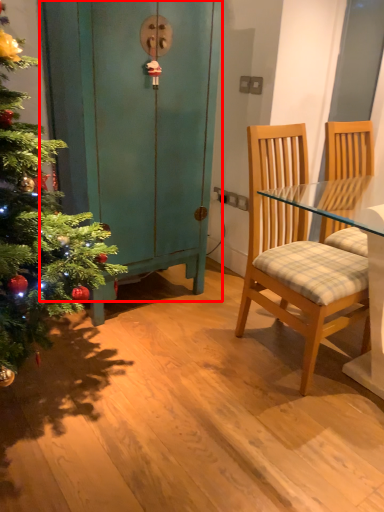
Question: From the image's perspective, considering the relative positions of dresser (annotated by the red box) and chair in the image provided, where is dresser (annotated by the red box) located with respect to the staircase?

Choices:
 (A) above
 (B) below

Answer: (A)